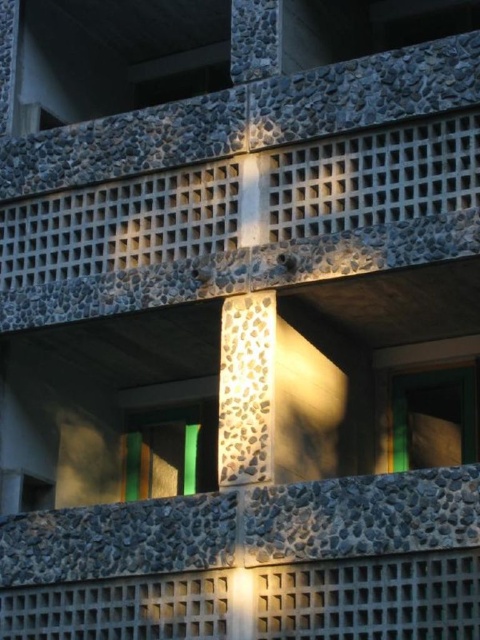
Can you confirm if green glass window at lower right is smaller than green glass window at center?

No, green glass window at lower right is not smaller than green glass window at center.

Is point (415, 426) closer to viewer compared to point (165, 468)?

Yes, it is in front of point (165, 468).

The width and height of the screenshot is (480, 640). Identify the location of green glass window at lower right. coord(434,417).